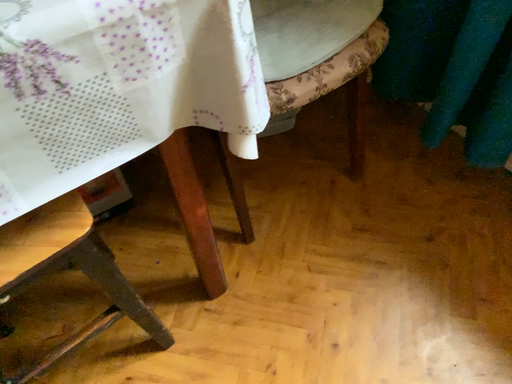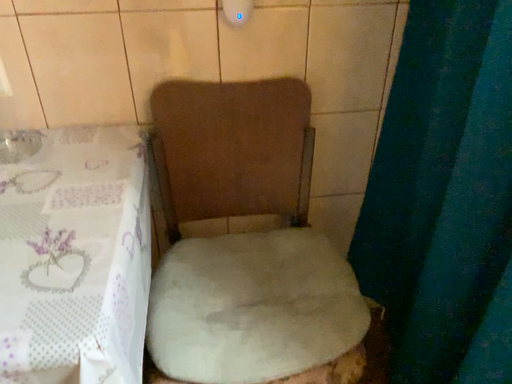
Question: Which way did the camera rotate in the video?

Choices:
 (A) rotated left
 (B) rotated right

Answer: (A)